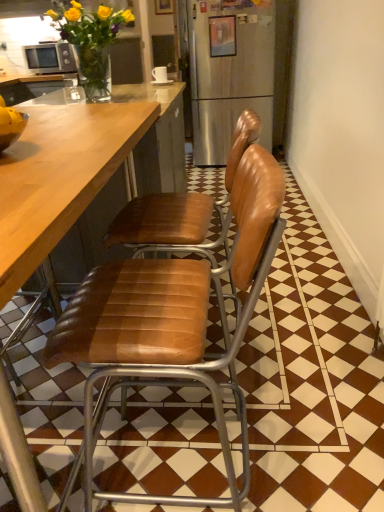
Locate an element on the screen. This screenshot has height=512, width=384. free spot below metallic silver bowl at left (from a real-world perspective) is located at coordinates [54, 422].